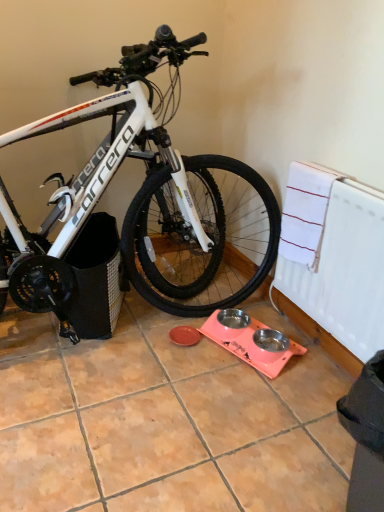
Describe the element at coordinates (142, 208) in the screenshot. I see `white matte bicycle at left` at that location.

The width and height of the screenshot is (384, 512). I want to click on white matte bicycle at left, so click(142, 208).

Locate an element on the screen. Image resolution: width=384 pixels, height=512 pixels. white matte bicycle at left is located at coordinates (142, 208).